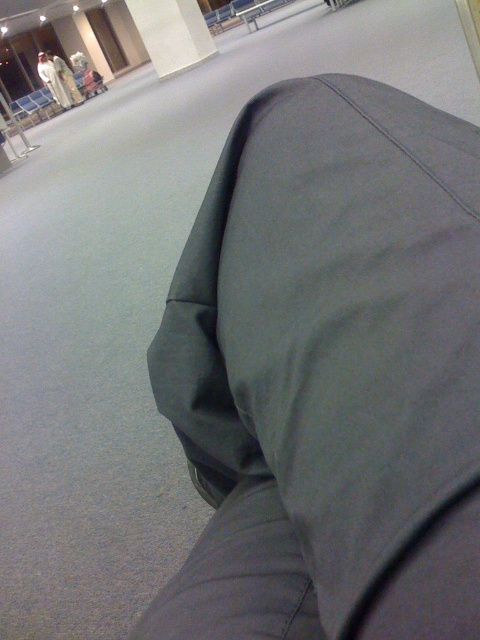
Question: Does gray fabric pants at lower right appear on the right side of white cotton robe at upper left?

Choices:
 (A) no
 (B) yes

Answer: (B)

Question: Is gray fabric pants at lower right below light beige fabric coat at upper left?

Choices:
 (A) no
 (B) yes

Answer: (B)

Question: Among these points, which one is nearest to the camera?

Choices:
 (A) (72, 76)
 (B) (43, 58)

Answer: (B)

Question: Can you confirm if light beige fabric coat at upper left is smaller than white cotton robe at upper left?

Choices:
 (A) yes
 (B) no

Answer: (B)

Question: Which of the following is the closest to the observer?

Choices:
 (A) white cotton robe at upper left
 (B) gray fabric pants at lower right

Answer: (B)

Question: Which object is positioned farthest from the gray fabric pants at lower right?

Choices:
 (A) light beige fabric coat at upper left
 (B) white cotton robe at upper left

Answer: (B)